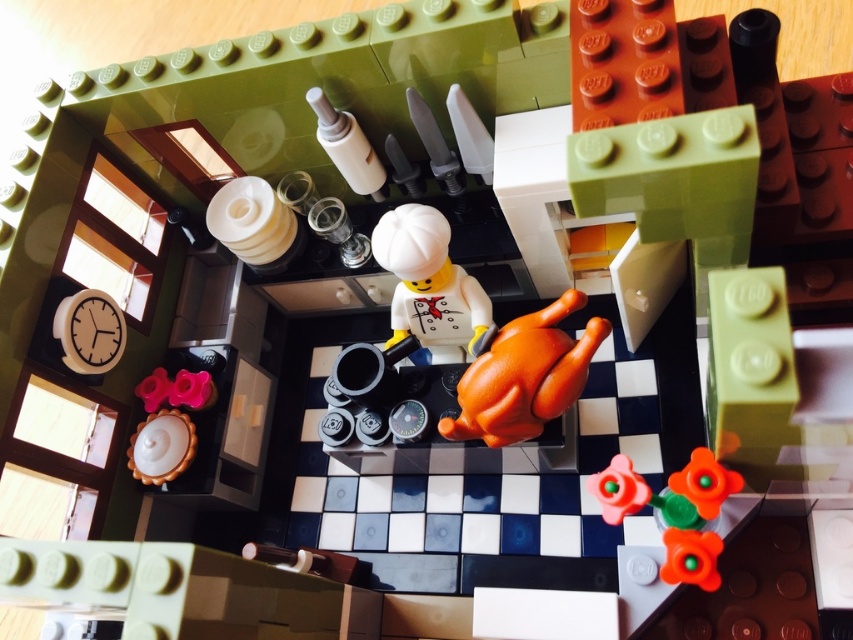
Question: Among these objects, which one is nearest to the camera?

Choices:
 (A) orange matte chicken at center
 (B) white matte chef hat at center

Answer: (A)

Question: Is orange matte chicken at center above orange matte flower at lower right?

Choices:
 (A) no
 (B) yes

Answer: (B)

Question: Does orange matte chicken at center come behind orange matte flower at lower right?

Choices:
 (A) no
 (B) yes

Answer: (B)

Question: Which of the following is the farthest from the observer?

Choices:
 (A) (500, 326)
 (B) (624, 508)
 (C) (419, 333)

Answer: (C)

Question: Which point is farther to the camera?

Choices:
 (A) (585, 365)
 (B) (622, 458)

Answer: (A)

Question: Is white matte chef hat at center positioned at the back of orange matte flower at lower right?

Choices:
 (A) no
 (B) yes

Answer: (B)